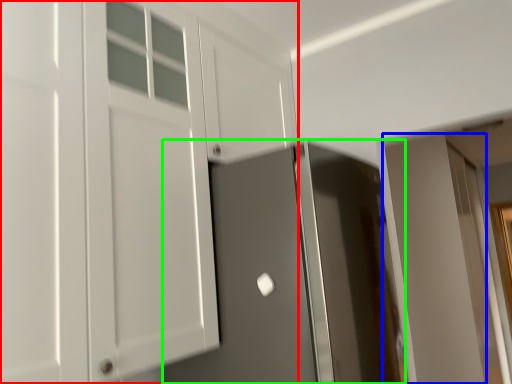
Question: Which is nearer to the cabinetry (highlighted by a red box)? door (highlighted by a blue box) or door (highlighted by a green box).

Choices:
 (A) door
 (B) door

Answer: (B)